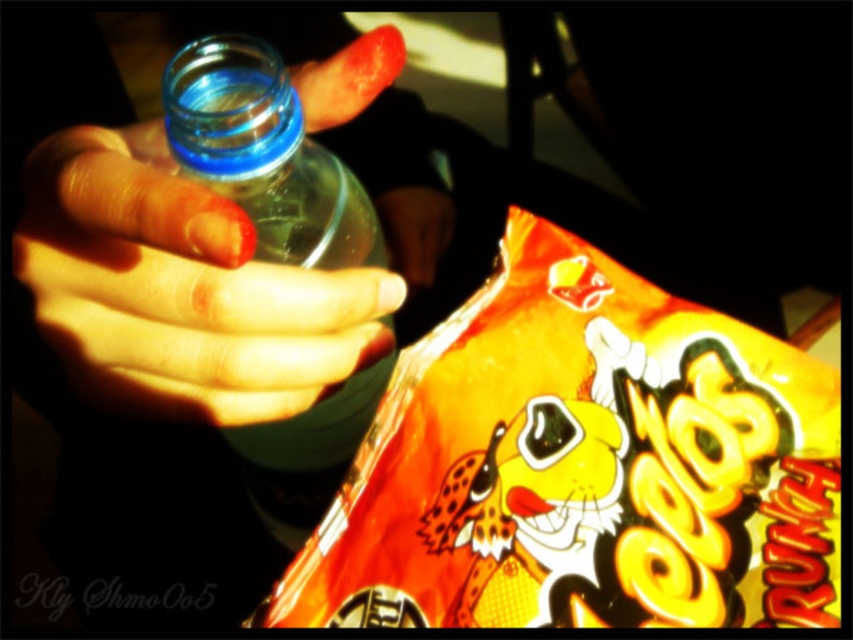
Question: Can you confirm if shiny orange snack at lower right is positioned to the right of translucent plastic hand at center?

Choices:
 (A) yes
 (B) no

Answer: (A)

Question: Is shiny orange snack at lower right wider than transparent plastic bottle at left?

Choices:
 (A) yes
 (B) no

Answer: (A)

Question: Which point appears closest to the camera in this image?

Choices:
 (A) (306, 310)
 (B) (258, 182)
 (C) (730, 330)

Answer: (A)

Question: Is shiny orange snack at lower right behind translucent plastic hand at center?

Choices:
 (A) no
 (B) yes

Answer: (B)

Question: Which of the following is the closest to the observer?

Choices:
 (A) transparent plastic bottle at left
 (B) shiny orange snack at lower right
 (C) translucent plastic hand at center

Answer: (C)

Question: Which object is closer to the camera taking this photo?

Choices:
 (A) translucent plastic hand at center
 (B) transparent plastic bottle at left

Answer: (A)